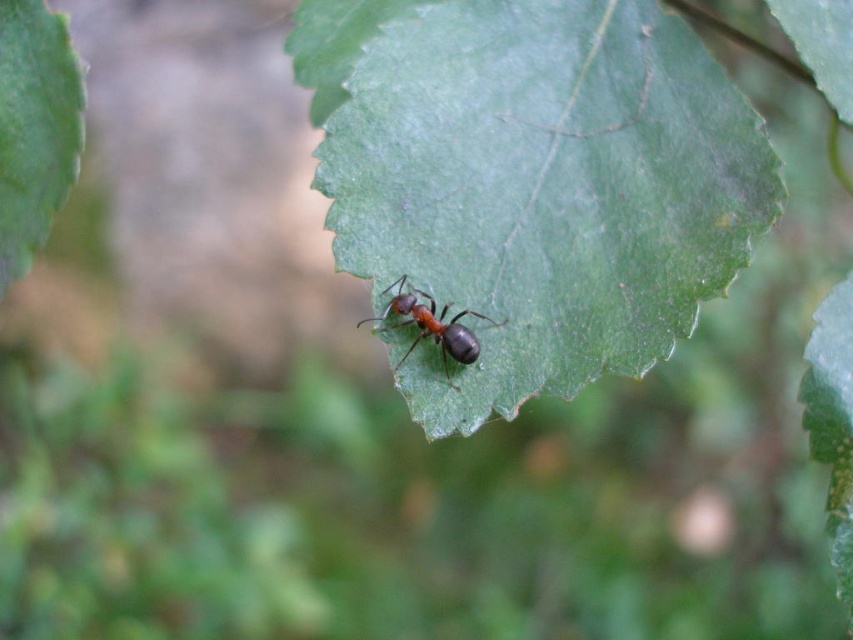
You are a gardener holding a magnifying glass and observing the green matte leaf at upper left and the shiny black ant at center. You want to measure the distance between them to determine if they are within a 60 cm safety zone for pesticide application. Are they within the required distance?

The distance between the green matte leaf at upper left and the shiny black ant at center is 56.86 centimeters, which is under the 60 cm safety zone. Therefore, they are within the required distance.

Looking at this image, you are a tiny explorer standing on the shiny black ant at center. Looking up, you see the green matte leaf at upper left. Which direction should you move to reach the leaf?

The green matte leaf at upper left is located above the shiny black ant at center, so you should move upward to reach it.